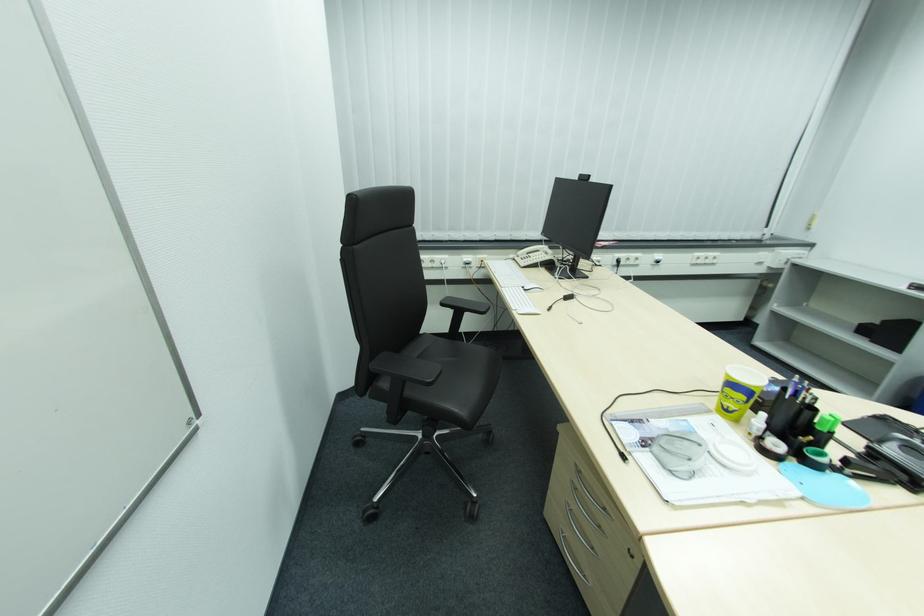
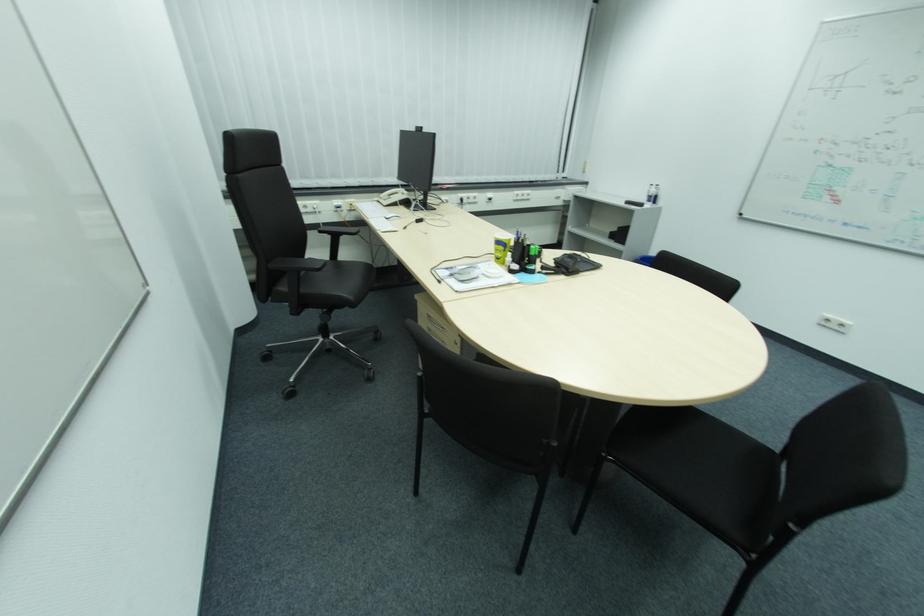
The point at (748,397) is marked in the first image. Where is the corresponding point in the second image?

(507, 248)